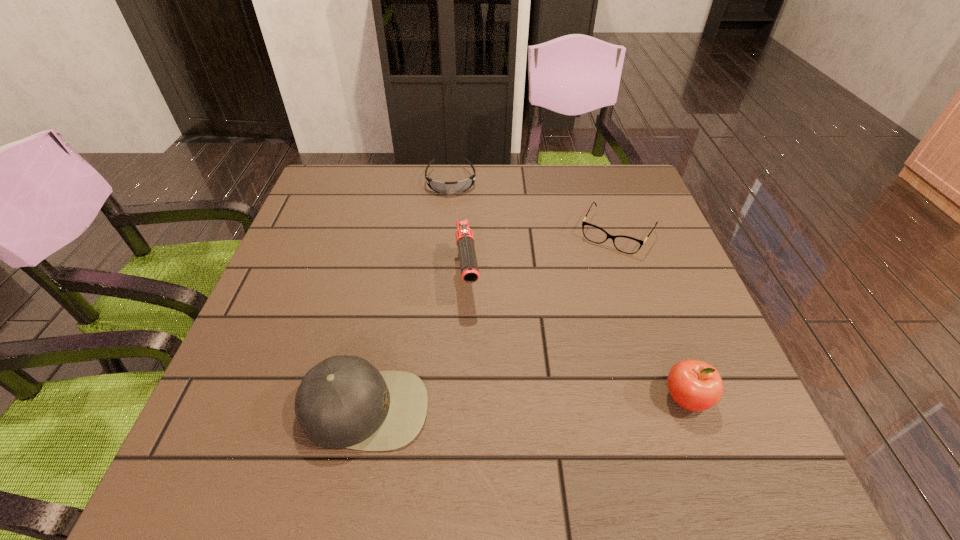
Locate an element on the screen. The width and height of the screenshot is (960, 540). cap is located at coordinates (342, 402).

You are a GUI agent. You are given a task and a screenshot of the screen. Output one action in this format:
    pyautogui.click(x=<x>, y=<y>)
    Task: Click on the apple
    
    Given the screenshot: What is the action you would take?
    pyautogui.click(x=694, y=385)

Locate an element on the screen. The height and width of the screenshot is (540, 960). spectacles is located at coordinates pos(629,245).

Locate an element on the screen. gun is located at coordinates (465, 242).

Identify the location of sunglasses. The height and width of the screenshot is (540, 960). (461, 186).

Where is `vacant space located 0.400m on the back of the apple`? This screenshot has height=540, width=960. vacant space located 0.400m on the back of the apple is located at coordinates (628, 240).

Image resolution: width=960 pixels, height=540 pixels. Identify the location of vacant point located on the front-facing side of the spectacles. (569, 314).

Image resolution: width=960 pixels, height=540 pixels. In order to click on free space located 0.210m on the front-facing side of the spectacles in this screenshot , I will do `click(571, 311)`.

In order to click on vacant area situated on the front-facing side of the spectacles in this screenshot , I will do `click(581, 293)`.

Locate an element on the screen. blank space located 0.090m at the aiming end of the gun is located at coordinates (473, 345).